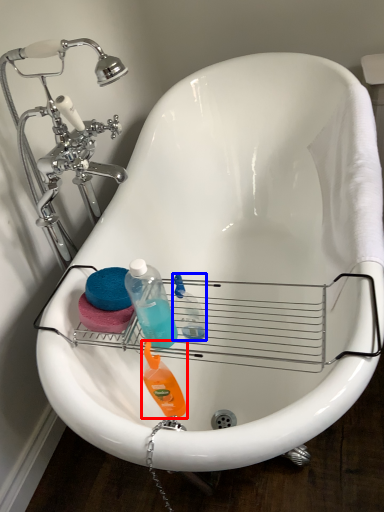
Question: Which of the following is the farthest to the observer, cleaning product (highlighted by a red box) or cleaning product (highlighted by a blue box)?

Choices:
 (A) cleaning product
 (B) cleaning product

Answer: (B)